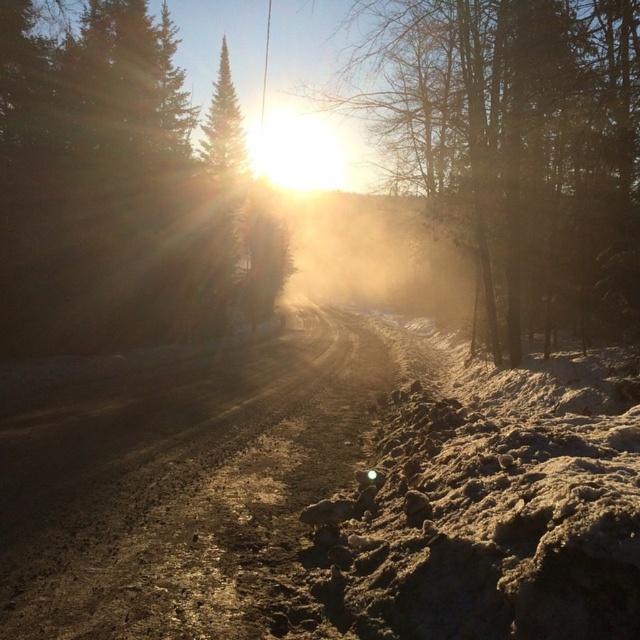
Question: Is dull brown dirt track at center further to camera compared to green matte tree at upper left?

Choices:
 (A) yes
 (B) no

Answer: (B)

Question: Among these objects, which one is nearest to the camera?

Choices:
 (A) dull brown dirt track at center
 (B) dull brown tree at center

Answer: (A)

Question: Does green matte tree at upper left have a larger size compared to dull brown tree at center?

Choices:
 (A) no
 (B) yes

Answer: (A)

Question: Is dull brown dirt track at center positioned behind dull brown tree at center?

Choices:
 (A) no
 (B) yes

Answer: (A)

Question: Which object appears farthest from the camera in this image?

Choices:
 (A) dull brown dirt track at center
 (B) green matte tree at upper left

Answer: (B)

Question: Among these points, which one is nearest to the camera?

Choices:
 (A) (328, 401)
 (B) (84, 148)
 (C) (365, 120)

Answer: (A)